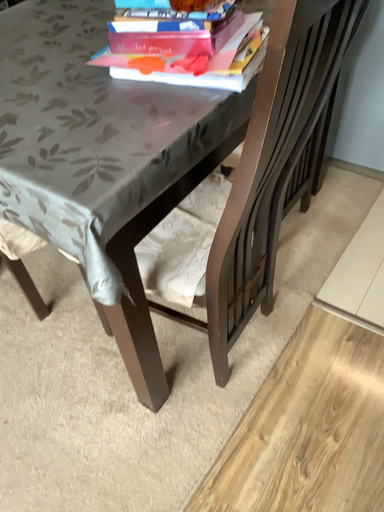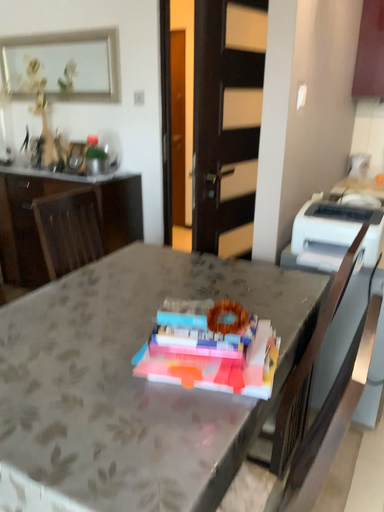
Question: Which way did the camera rotate in the video?

Choices:
 (A) rotated right
 (B) rotated left

Answer: (A)